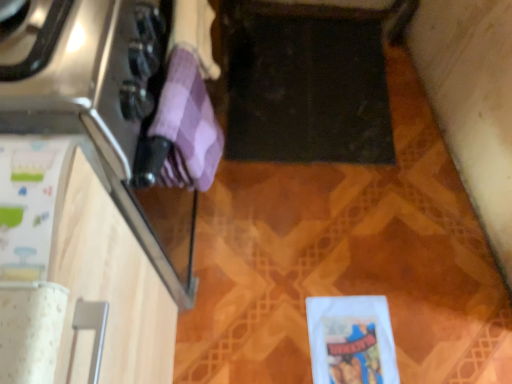
Question: Is white matte wrapping paper at lower right, the 3th wrapping paper from the left, at the right side of white paper at left, which appears as the 2th wrapping paper when ordered from the bottom?

Choices:
 (A) no
 (B) yes

Answer: (B)

Question: Does white matte wrapping paper at lower right, the 3th wrapping paper from the left, come in front of white paper at left, the third wrapping paper in the right-to-left sequence?

Choices:
 (A) yes
 (B) no

Answer: (B)

Question: Is white paper at left, which appears as the 2th wrapping paper when ordered from the bottom, located within white matte wrapping paper at lower right, which is counted as the 3th wrapping paper, starting from the front?

Choices:
 (A) yes
 (B) no

Answer: (B)

Question: Can you confirm if white matte wrapping paper at lower right, which is counted as the 3th wrapping paper, starting from the front, is thinner than white paper at left, marked as the 2th wrapping paper in a top-to-bottom arrangement?

Choices:
 (A) no
 (B) yes

Answer: (B)

Question: Are white matte wrapping paper at lower right, the 3th wrapping paper from the left, and white paper at left, marked as the 2th wrapping paper in a top-to-bottom arrangement, located far from each other?

Choices:
 (A) no
 (B) yes

Answer: (A)

Question: Considering the positions of point (7, 231) and point (324, 314), is point (7, 231) closer or farther from the camera than point (324, 314)?

Choices:
 (A) farther
 (B) closer

Answer: (B)

Question: From a real-world perspective, relative to white matte wrapping paper at lower right, marked as the 1th wrapping paper in a bottom-to-top arrangement, is white paper at left, which is the third wrapping paper in back-to-front order, vertically above or below?

Choices:
 (A) above
 (B) below

Answer: (A)

Question: Considering the positions of white paper at left, which is the third wrapping paper in back-to-front order, and white matte wrapping paper at lower right, placed as the first wrapping paper when sorted from right to left, in the image, is white paper at left, which is the third wrapping paper in back-to-front order, taller or shorter than white matte wrapping paper at lower right, placed as the first wrapping paper when sorted from right to left,?

Choices:
 (A) tall
 (B) short

Answer: (A)

Question: From the image's perspective, is white paper at left, which is the first wrapping paper from front to back, above or below white matte wrapping paper at lower right, the 3th wrapping paper from the left?

Choices:
 (A) below
 (B) above

Answer: (B)

Question: From a real-world perspective, is white matte wrapping paper at lower right, marked as the 1th wrapping paper in a bottom-to-top arrangement, positioned above or below purple checkered towel at left, which is the 2th wrapping paper in left-to-right order?

Choices:
 (A) above
 (B) below

Answer: (B)

Question: Is white matte wrapping paper at lower right, which is the 3th wrapping paper from top to bottom, inside the boundaries of purple checkered towel at left, which is the second wrapping paper from back to front, or outside?

Choices:
 (A) inside
 (B) outside

Answer: (B)

Question: Considering the positions of white matte wrapping paper at lower right, marked as the 1th wrapping paper in a bottom-to-top arrangement, and purple checkered towel at left, which is the 3th wrapping paper in bottom-to-top order, in the image, is white matte wrapping paper at lower right, marked as the 1th wrapping paper in a bottom-to-top arrangement, bigger or smaller than purple checkered towel at left, which is the 3th wrapping paper in bottom-to-top order,?

Choices:
 (A) small
 (B) big

Answer: (A)

Question: Considering the relative positions of white matte wrapping paper at lower right, which is the 3th wrapping paper from top to bottom, and purple checkered towel at left, positioned as the 1th wrapping paper in top-to-bottom order, in the image provided, is white matte wrapping paper at lower right, which is the 3th wrapping paper from top to bottom, to the left or to the right of purple checkered towel at left, positioned as the 1th wrapping paper in top-to-bottom order,?

Choices:
 (A) right
 (B) left

Answer: (A)

Question: In terms of size, does white matte wrapping paper at lower right, which is the 3th wrapping paper from top to bottom, appear bigger or smaller than white paper at left, the third wrapping paper in the right-to-left sequence?

Choices:
 (A) big
 (B) small

Answer: (B)

Question: Is white matte wrapping paper at lower right, marked as the 1th wrapping paper in a bottom-to-top arrangement, taller or shorter than white paper at left, which appears as the 2th wrapping paper when ordered from the bottom?

Choices:
 (A) tall
 (B) short

Answer: (B)